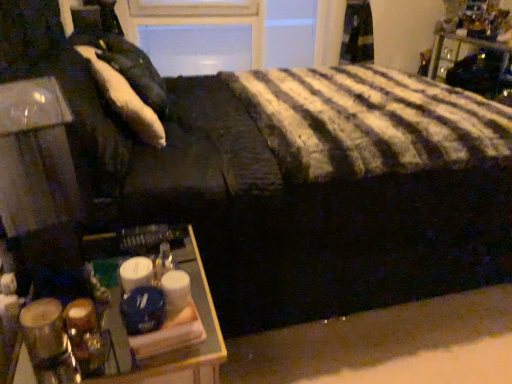
Question: From a real-world perspective, is wooden tray at lower left on top of metallic black nightstand at upper right?

Choices:
 (A) no
 (B) yes

Answer: (A)

Question: Is wooden tray at lower left further to the viewer compared to metallic black nightstand at upper right?

Choices:
 (A) yes
 (B) no

Answer: (B)

Question: Does wooden tray at lower left have a greater width compared to metallic black nightstand at upper right?

Choices:
 (A) yes
 (B) no

Answer: (A)

Question: Does wooden tray at lower left come in front of metallic black nightstand at upper right?

Choices:
 (A) no
 (B) yes

Answer: (B)

Question: Is wooden tray at lower left not inside metallic black nightstand at upper right?

Choices:
 (A) yes
 (B) no

Answer: (A)

Question: Considering the positions of point (153, 119) and point (208, 332), is point (153, 119) closer or farther from the camera than point (208, 332)?

Choices:
 (A) farther
 (B) closer

Answer: (A)

Question: Considering their positions, is white soft pillow at upper left located in front of or behind wooden tray at lower left?

Choices:
 (A) front
 (B) behind

Answer: (B)

Question: Choose the correct answer: Is white soft pillow at upper left inside wooden tray at lower left or outside it?

Choices:
 (A) outside
 (B) inside

Answer: (A)

Question: Is white soft pillow at upper left to the left or to the right of wooden tray at lower left in the image?

Choices:
 (A) right
 (B) left

Answer: (B)

Question: Based on their sizes in the image, would you say wooden tray at lower left is bigger or smaller than metallic black nightstand at upper right?

Choices:
 (A) big
 (B) small

Answer: (A)

Question: Which is correct: wooden tray at lower left is inside metallic black nightstand at upper right, or outside of it?

Choices:
 (A) inside
 (B) outside

Answer: (B)

Question: Visually, is wooden tray at lower left positioned to the left or to the right of metallic black nightstand at upper right?

Choices:
 (A) right
 (B) left

Answer: (B)

Question: From a real-world perspective, is wooden tray at lower left physically located above or below metallic black nightstand at upper right?

Choices:
 (A) below
 (B) above

Answer: (A)

Question: In the image, is white soft pillow at upper left positioned in front of or behind metallic black nightstand at upper right?

Choices:
 (A) front
 (B) behind

Answer: (A)

Question: From the image's perspective, is white soft pillow at upper left positioned above or below metallic black nightstand at upper right?

Choices:
 (A) above
 (B) below

Answer: (B)